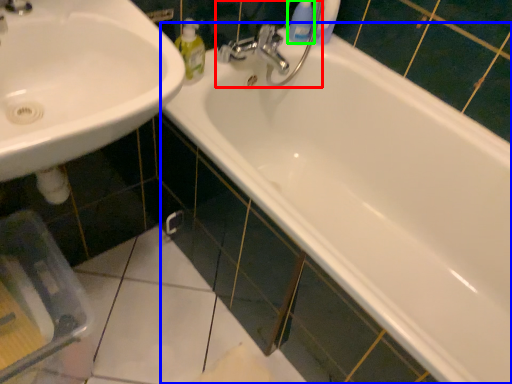
Question: Estimate the real-world distances between objects in this image. Which object is closer to plumbing fixture (highlighted by a red box), bathtub (highlighted by a blue box) or cleaning product (highlighted by a green box)?

Choices:
 (A) bathtub
 (B) cleaning product

Answer: (B)